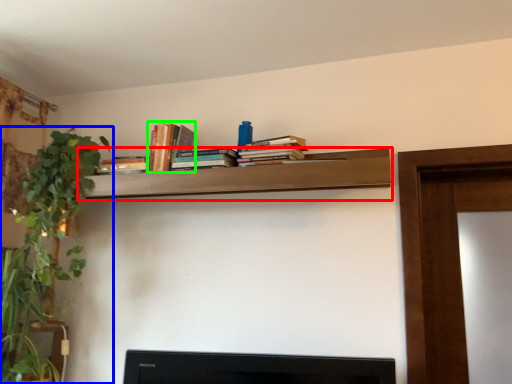
Question: Estimate the real-world distances between objects in this image. Which object is farther from shelf (highlighted by a red box), houseplant (highlighted by a blue box) or book (highlighted by a green box)?

Choices:
 (A) houseplant
 (B) book

Answer: (A)